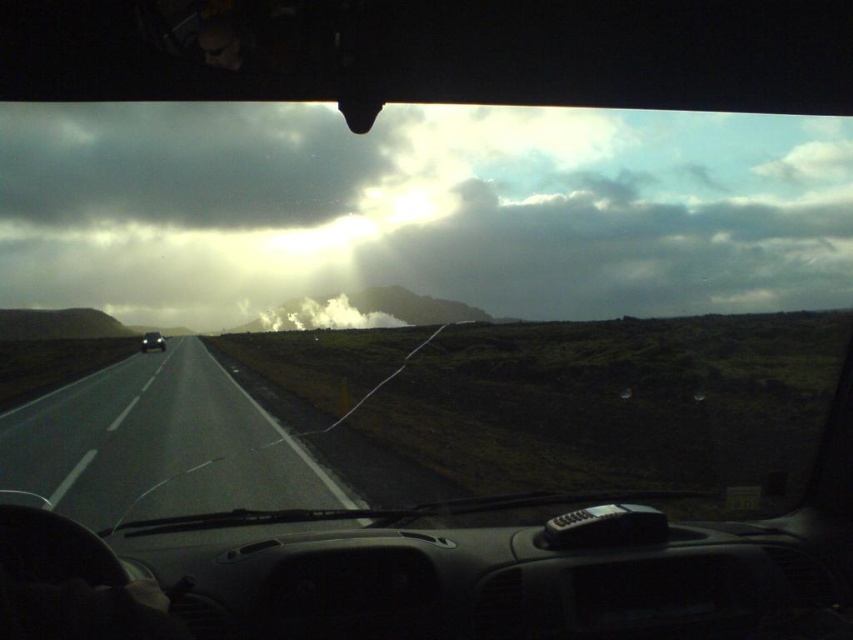
Is cloudy sky at upper center taller than asphalt road at center?

Yes.

Is point (779, 280) farther from camera compared to point (12, 429)?

Yes, point (779, 280) is farther from viewer.

Locate an element on the screen. cloudy sky at upper center is located at coordinates pos(421,209).

Between point (209, 396) and point (152, 346), which one is positioned in front?

Positioned in front is point (209, 396).

Does asphalt road at center have a larger size compared to shiny black car at center?

No, asphalt road at center is not bigger than shiny black car at center.

Between point (173, 513) and point (149, 340), which one is positioned behind?

The point (149, 340) is behind.

The width and height of the screenshot is (853, 640). What are the coordinates of `asphalt road at center` in the screenshot? It's located at (155, 444).

Who is more distant from viewer, (x=207, y=250) or (x=149, y=339)?

The point (x=207, y=250) is more distant.

Between cloudy sky at upper center and shiny black car at center, which one appears on the right side from the viewer's perspective?

cloudy sky at upper center

Describe the element at coordinates (421, 209) in the screenshot. This screenshot has height=640, width=853. I see `cloudy sky at upper center` at that location.

The height and width of the screenshot is (640, 853). In order to click on cloudy sky at upper center in this screenshot , I will do `click(421, 209)`.